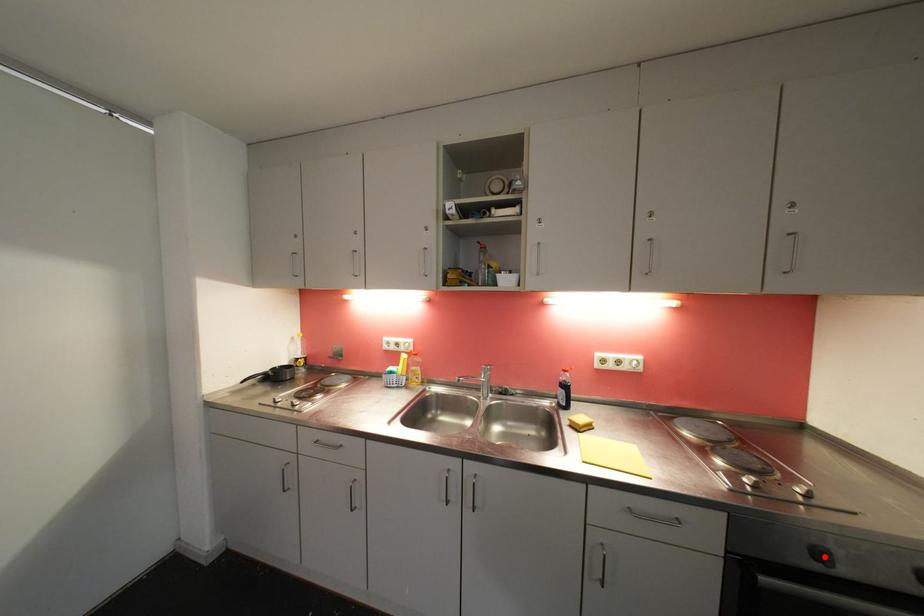
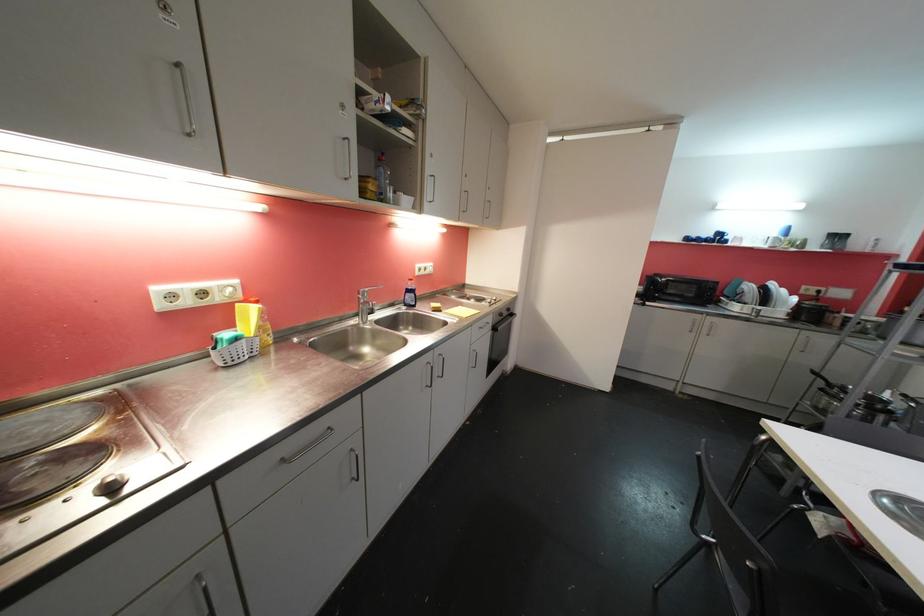
Question: I am providing you with two images of the same scene from different viewpoints. Image1 has a red point marked. In image2, the corresponding 3D location appears at what relative position? Reply with the corresponding letter.

Choices:
 (A) Closer
 (B) Farther

Answer: (B)